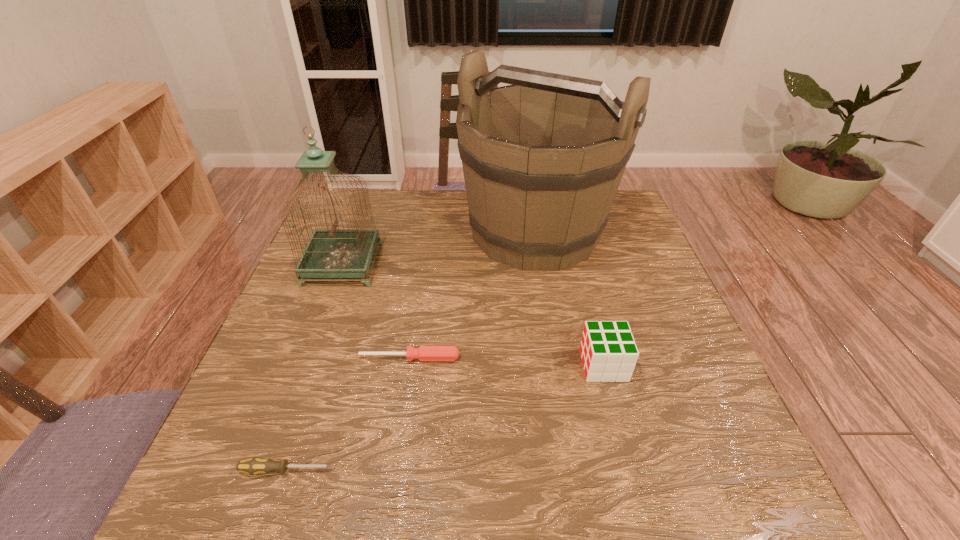
Find the location of a particular element. The image size is (960, 540). free space between the nearer screwdriver and the farther screwdriver is located at coordinates (348, 414).

The height and width of the screenshot is (540, 960). In order to click on blank region between the second tallest object and the tallest object in this screenshot , I will do `click(439, 248)`.

I want to click on vacant space in between the third shortest object and the nearest object, so click(445, 417).

Locate an element on the screen. The image size is (960, 540). vacant space in between the birdcage and the tallest object is located at coordinates (439, 248).

Where is `the fourth closest object to the farther screwdriver`? the fourth closest object to the farther screwdriver is located at coordinates (608, 350).

Find the location of a particular element. object that stands as the third closest to the farther screwdriver is located at coordinates (543, 158).

Identify the location of free space that satisfies the following two spatial constraints: 1. at the door of the farther screwdriver; 2. on the left side of the fourth shortest object. (308, 358).

Identify the location of blank space that satisfies the following two spatial constraints: 1. at the door of the birdcage; 2. on the back side of the farther screwdriver. (308, 358).